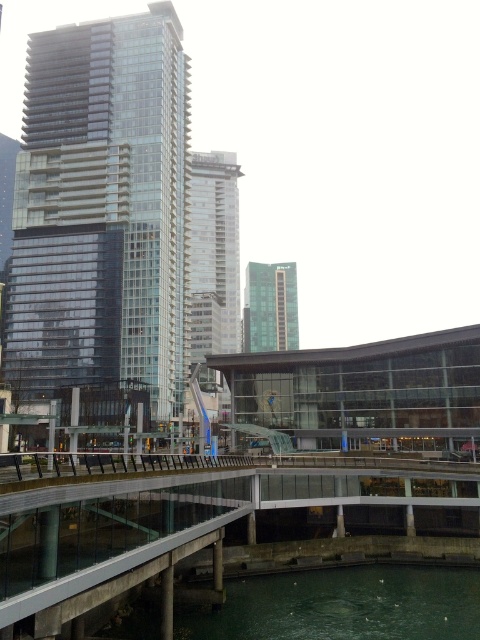
Question: Estimate the real-world distances between objects in this image. Which object is farther from the concrete/gray pedestrian bridge at lower center?

Choices:
 (A) glassy reflective skyscraper at left
 (B) green glass building at center

Answer: (B)

Question: Which object is positioned closest to the green glass building at center?

Choices:
 (A) concrete/gray pedestrian bridge at lower center
 (B) silver glass tower at center

Answer: (B)

Question: Is glassy reflective skyscraper at left above green glass building at center?

Choices:
 (A) yes
 (B) no

Answer: (A)

Question: Which is farther from the green glass building at center?

Choices:
 (A) silver glass tower at center
 (B) concrete/gray pedestrian bridge at lower center
 (C) glassy reflective skyscraper at left

Answer: (B)

Question: Where is glassy reflective skyscraper at left located in relation to concrete/gray pedestrian bridge at lower center in the image?

Choices:
 (A) above
 (B) below

Answer: (A)

Question: Does silver glass tower at center have a smaller size compared to green glass building at center?

Choices:
 (A) no
 (B) yes

Answer: (A)